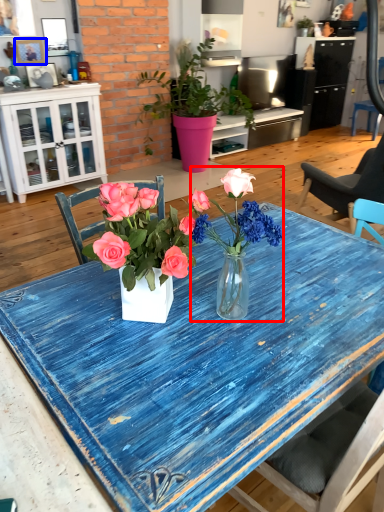
Question: Among these objects, which one is nearest to the camera, carnation (highlighted by a red box) or picture frame (highlighted by a blue box)?

Choices:
 (A) carnation
 (B) picture frame

Answer: (A)